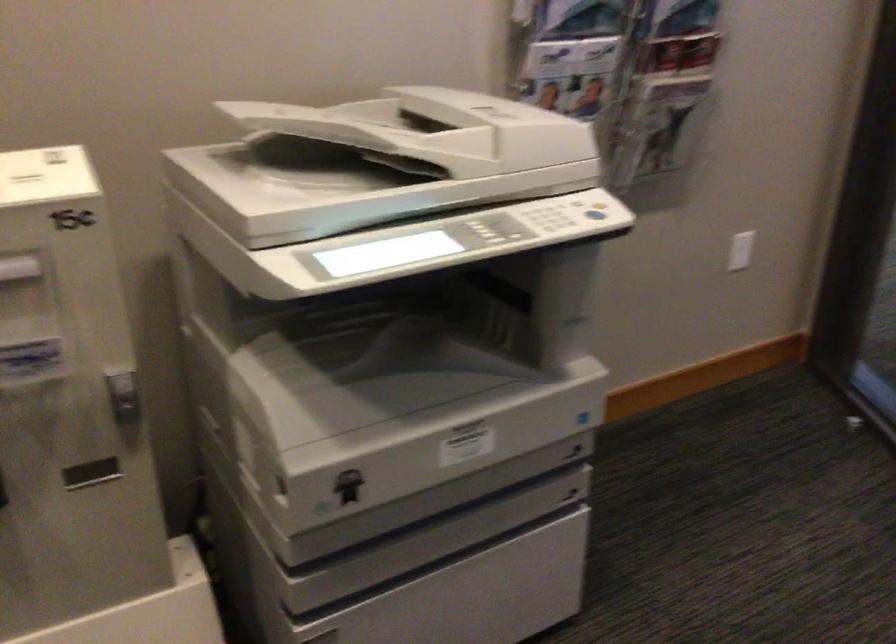
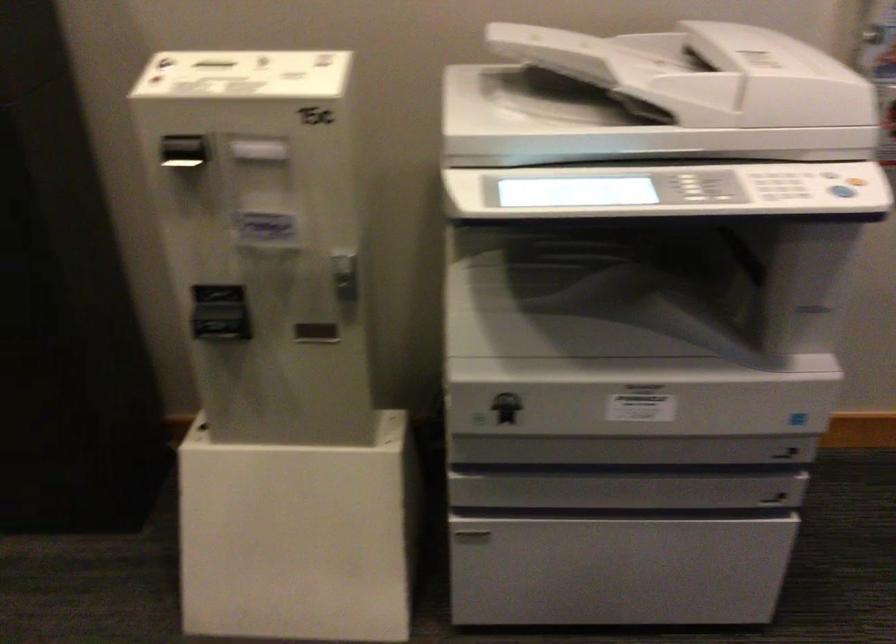
The point at (599, 205) is marked in the first image. Where is the corresponding point in the second image?

(855, 181)